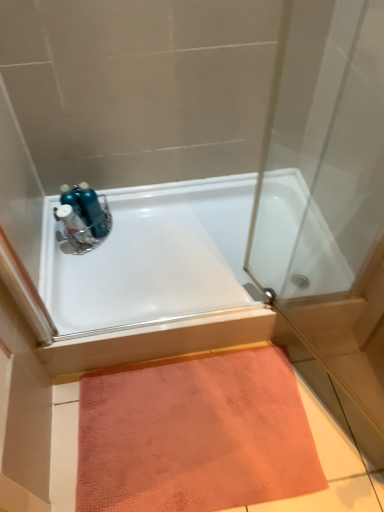
Question: From the image's perspective, relative to white glossy bathtub at upper center, is metallic blue sink at upper left above or below?

Choices:
 (A) below
 (B) above

Answer: (B)

Question: From a real-world perspective, relative to white glossy bathtub at upper center, is metallic blue sink at upper left vertically above or below?

Choices:
 (A) above
 (B) below

Answer: (A)

Question: Which is nearer to the metallic blue sink at upper left?

Choices:
 (A) white glossy bathtub at upper center
 (B) orange textured mat at lower center
 (C) blue metallic bottles at upper left

Answer: (C)

Question: Which of these objects is positioned closest to the orange textured mat at lower center?

Choices:
 (A) blue metallic bottles at upper left
 (B) metallic blue sink at upper left
 (C) white glossy bathtub at upper center

Answer: (C)